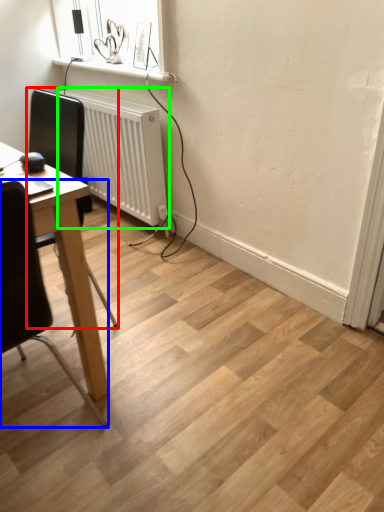
Question: Considering the real-world distances, which object is closest to chair (highlighted by a red box)? chair (highlighted by a blue box) or radiator (highlighted by a green box).

Choices:
 (A) chair
 (B) radiator

Answer: (B)